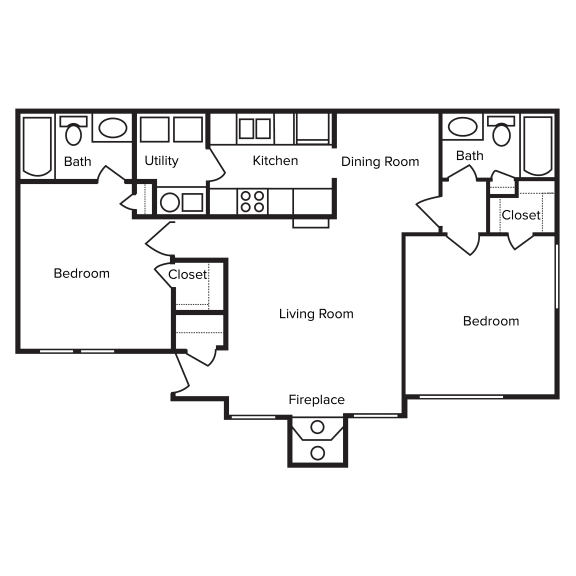
This screenshot has height=576, width=576. In order to click on bathroom in this screenshot , I will do `click(488, 147)`, `click(86, 149)`.